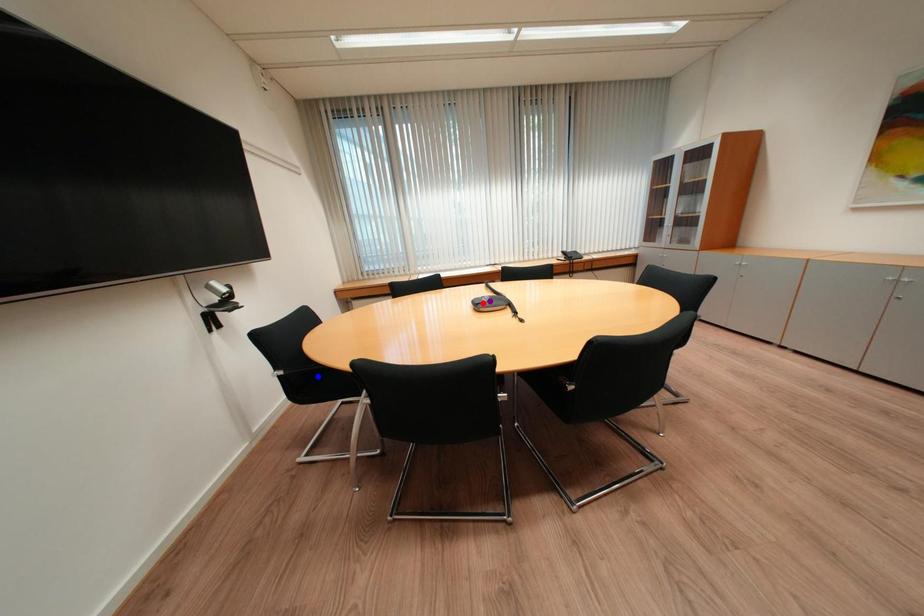
Order these from farthest to nearest:
1. red point
2. blue point
3. purple point

purple point, red point, blue point